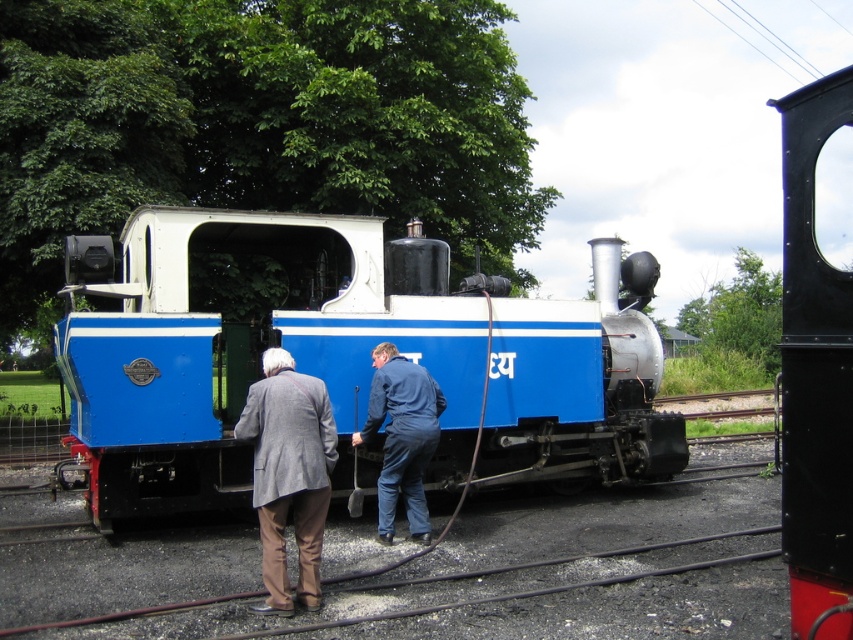
You are a passenger trying to locate your belongings stored in the gray woolen coat at center and the black metal door at upper right. Which object is positioned higher up in the scene?

→ The gray woolen coat at center is positioned higher up than the black metal door at upper right.

You are a photographer trying to capture a clear image of the blue painted steel train at center and the gray woolen coat at center. If you want to ensure both subjects are fully visible in your photo without any part being cut off, which subject should you prioritize positioning closer to the center of the frame?

The gray woolen coat at center should be positioned closer to the center of the frame because the blue painted steel train at center might be wider than the gray woolen coat at center, making it harder to fit entirely within the frame if placed off center.

You are a maintenance worker needing to move a spare part from the storage room to the blue painted steel train at center. The storage room is located behind the black metal door at upper right. Considering the door width, will the spare part, which is as wide as the train, fit through the door?

The blue painted steel train at center is wider than the black metal door at upper right, so the spare part, which is as wide as the train, will not fit through the door.